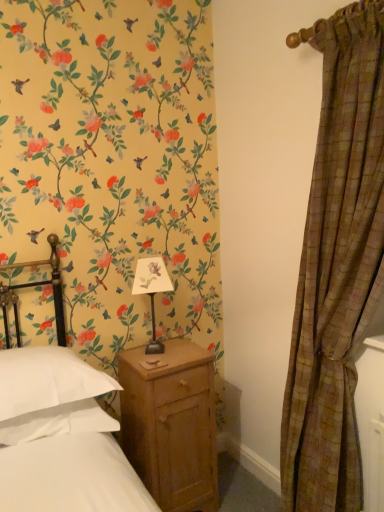
Question: From a real-world perspective, is white soft pillow at lower left located beneath brown plaid curtain at right?

Choices:
 (A) no
 (B) yes

Answer: (B)

Question: Are white soft pillow at lower left and brown plaid curtain at right located far from each other?

Choices:
 (A) no
 (B) yes

Answer: (A)

Question: Is white soft pillow at lower left further to the viewer compared to brown plaid curtain at right?

Choices:
 (A) no
 (B) yes

Answer: (B)

Question: Considering the relative sizes of white soft pillow at lower left and brown plaid curtain at right in the image provided, is white soft pillow at lower left shorter than brown plaid curtain at right?

Choices:
 (A) yes
 (B) no

Answer: (A)

Question: Is white soft pillow at lower left oriented away from brown plaid curtain at right?

Choices:
 (A) no
 (B) yes

Answer: (A)

Question: Can brown plaid curtain at right be found inside white soft pillow at lower left?

Choices:
 (A) no
 (B) yes

Answer: (A)

Question: Can you confirm if matte black table lamp at center is wider than white soft pillow at lower left?

Choices:
 (A) yes
 (B) no

Answer: (B)

Question: Is the depth of matte black table lamp at center greater than that of white soft pillow at lower left?

Choices:
 (A) yes
 (B) no

Answer: (A)

Question: Is matte black table lamp at center aimed at white soft pillow at lower left?

Choices:
 (A) yes
 (B) no

Answer: (B)

Question: Is matte black table lamp at center at the right side of white soft pillow at lower left?

Choices:
 (A) yes
 (B) no

Answer: (A)

Question: Is matte black table lamp at center not within white soft pillow at lower left?

Choices:
 (A) no
 (B) yes

Answer: (B)

Question: Is matte black table lamp at center far away from white soft pillow at lower left?

Choices:
 (A) yes
 (B) no

Answer: (B)

Question: Considering the relative sizes of white soft pillow at lower left and matte black table lamp at center in the image provided, is white soft pillow at lower left taller than matte black table lamp at center?

Choices:
 (A) no
 (B) yes

Answer: (A)